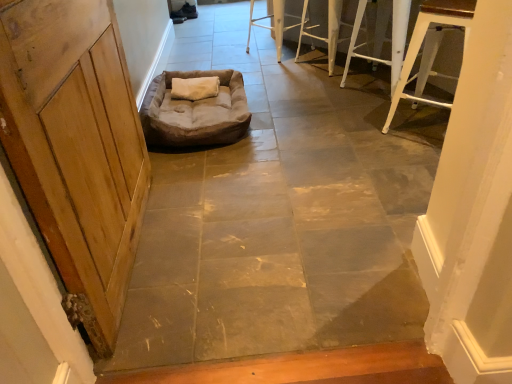
Question: Considering the relative sizes of brown suede dog bed at center and white metal stool at upper right, acting as the fourth furniture starting from the back, in the image provided, is brown suede dog bed at center bigger than white metal stool at upper right, acting as the fourth furniture starting from the back,?

Choices:
 (A) yes
 (B) no

Answer: (A)

Question: From a real-world perspective, is brown suede dog bed at center beneath white metal stool at upper right, acting as the fourth furniture starting from the back?

Choices:
 (A) no
 (B) yes

Answer: (B)

Question: From the image's perspective, is brown suede dog bed at center under white metal stool at upper right, which is counted as the 1th furniture, starting from the front?

Choices:
 (A) yes
 (B) no

Answer: (A)

Question: From a real-world perspective, is brown suede dog bed at center on top of white metal stool at upper right, acting as the fourth furniture starting from the back?

Choices:
 (A) no
 (B) yes

Answer: (A)

Question: Does brown suede dog bed at center lie behind white metal stool at upper right, acting as the fourth furniture starting from the back?

Choices:
 (A) no
 (B) yes

Answer: (B)

Question: Would you say white metal stool at upper right, which is counted as the 1th furniture, starting from the front, is to the left or to the right of wooden door at left in the picture?

Choices:
 (A) left
 (B) right

Answer: (B)

Question: Considering their positions, is white metal stool at upper right, acting as the fourth furniture starting from the back, located in front of or behind wooden door at left?

Choices:
 (A) front
 (B) behind

Answer: (B)

Question: From the image's perspective, is white metal stool at upper right, which is counted as the 1th furniture, starting from the front, positioned above or below wooden door at left?

Choices:
 (A) below
 (B) above

Answer: (B)

Question: Does point tap(398, 89) appear closer or farther from the camera than point tap(96, 329)?

Choices:
 (A) closer
 (B) farther

Answer: (B)

Question: From the image's perspective, is brown suede dog bed at center above or below wooden door at left?

Choices:
 (A) below
 (B) above

Answer: (B)

Question: Looking at their shapes, would you say brown suede dog bed at center is wider or thinner than wooden door at left?

Choices:
 (A) wide
 (B) thin

Answer: (A)

Question: Would you say brown suede dog bed at center is inside or outside wooden door at left?

Choices:
 (A) inside
 (B) outside

Answer: (B)

Question: From a real-world perspective, relative to wooden door at left, is brown suede dog bed at center vertically above or below?

Choices:
 (A) below
 (B) above

Answer: (A)

Question: In terms of size, does brown fabric dog bed at center appear bigger or smaller than white metal stool at upper right, acting as the fourth furniture starting from the back?

Choices:
 (A) small
 (B) big

Answer: (A)

Question: In the image, is brown fabric dog bed at center positioned in front of or behind white metal stool at upper right, which is counted as the 1th furniture, starting from the front?

Choices:
 (A) front
 (B) behind

Answer: (A)